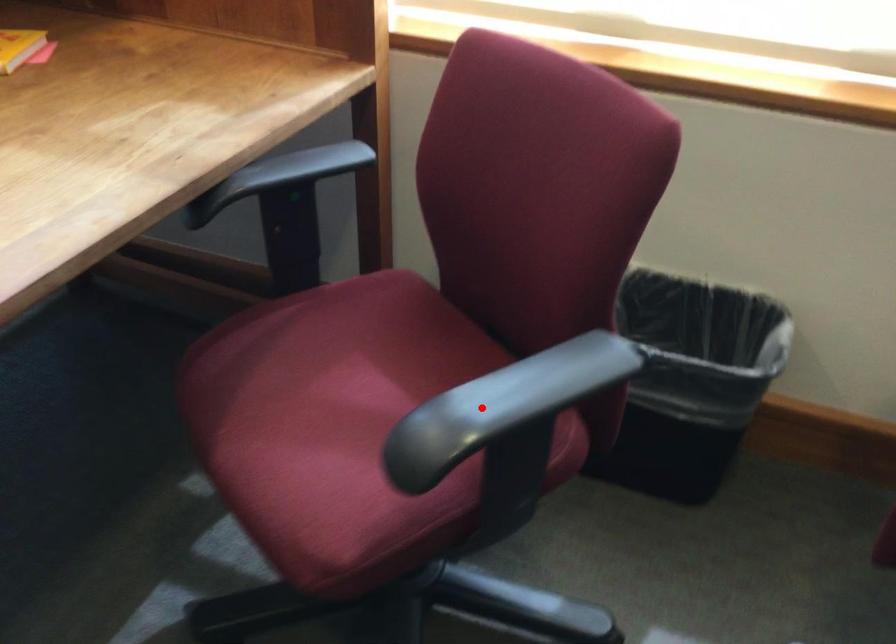
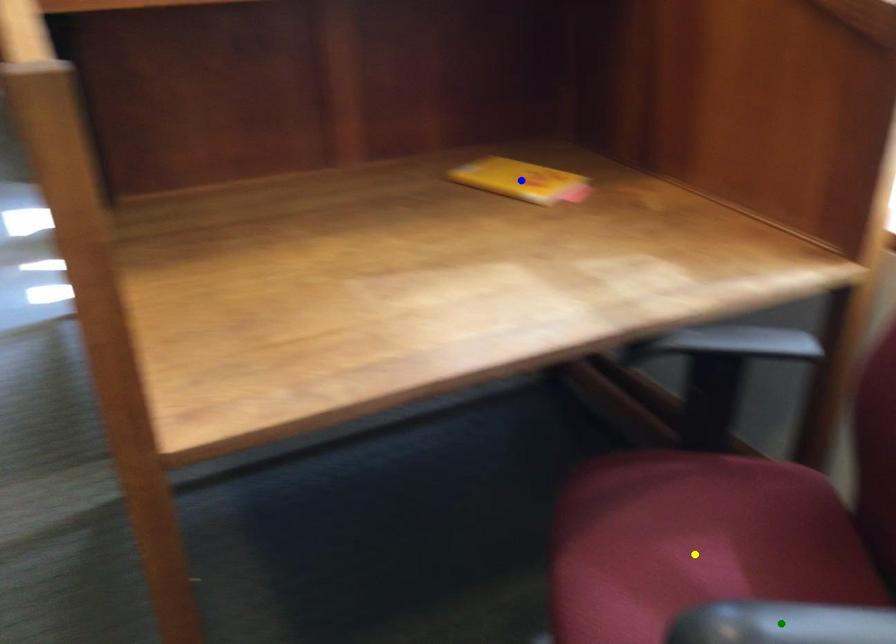
Question: I am providing you with two images of the same scene from different viewpoints. A red point is marked on the first image. You are given multiple points on the second image. In image 2, which mark is for the same physical point as the one in image 1?

Choices:
 (A) yellow point
 (B) blue point
 (C) green point

Answer: (C)